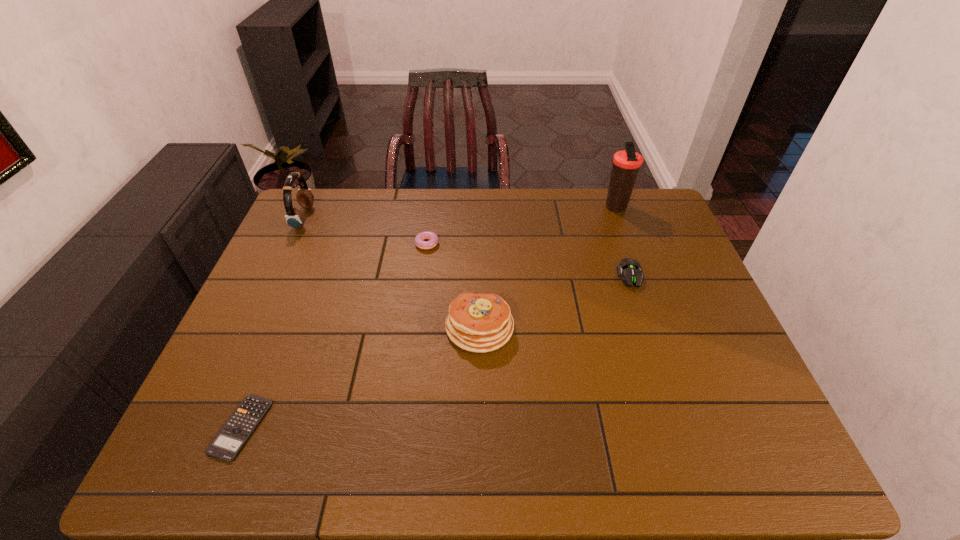
Find the location of a particular element. This screenshot has height=540, width=960. vacant region located on the ear cup of the headset is located at coordinates (424, 218).

This screenshot has height=540, width=960. I want to click on free point located 0.120m on the back of the fourth object from left to right, so click(x=480, y=271).

Identify the location of vacant space located on the front of the doughnut. (416, 307).

Image resolution: width=960 pixels, height=540 pixels. Identify the location of vacant region located on the back of the computer mouse. (621, 249).

Where is `vacant space located 0.130m on the back of the nearest object`? This screenshot has width=960, height=540. vacant space located 0.130m on the back of the nearest object is located at coordinates coord(273,349).

In order to click on thermos bottle at the far edge in this screenshot , I will do `click(626, 164)`.

Find the location of a particular element. headset at the far edge is located at coordinates (294, 217).

Locate an element on the screen. This screenshot has height=540, width=960. object present at the near edge is located at coordinates tap(227, 444).

This screenshot has width=960, height=540. I want to click on headset present at the left edge, so click(x=294, y=217).

I want to click on calculator positioned at the left edge, so click(x=227, y=444).